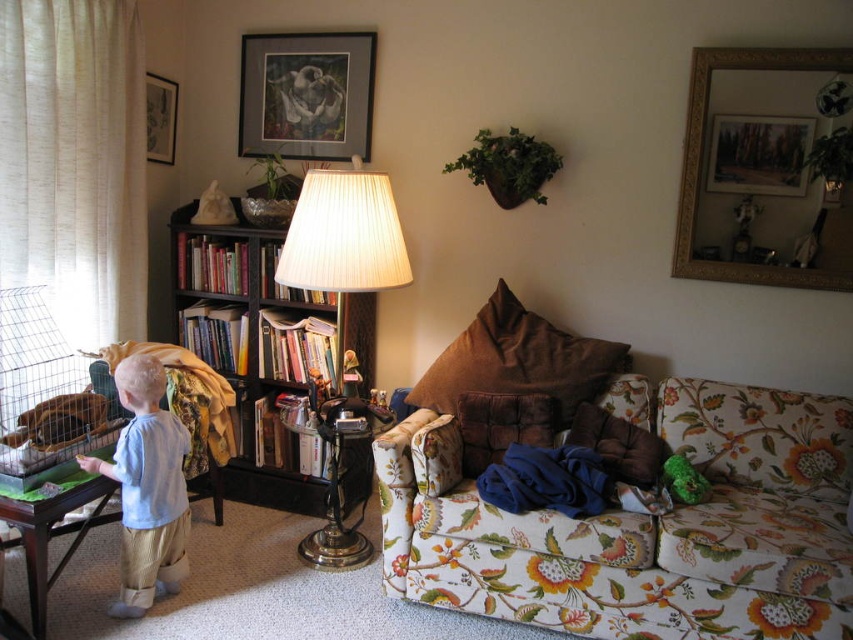
Question: Which of the following is the closest to the observer?

Choices:
 (A) matte black picture frame at upper center
 (B) black wood bookcase at left
 (C) green fuzzy toy at couch
 (D) light blue cotton shirt at lower left

Answer: (D)

Question: Which of these objects is positioned farthest from the gold-framed mirror at upper right?

Choices:
 (A) black wood bookcase at left
 (B) matte black picture frame at upper left
 (C) light blue cotton shirt at lower left
 (D) green fuzzy toy at couch

Answer: (B)

Question: Does black wood bookcase at left have a smaller size compared to matte black picture frame at upper left?

Choices:
 (A) yes
 (B) no

Answer: (B)

Question: Based on their relative distances, which object is farther from the matte black picture frame at upper left?

Choices:
 (A) floral fabric couch at center
 (B) green fuzzy toy at couch
 (C) wooden framed picture at upper center

Answer: (B)

Question: Does floral fabric couch at center have a larger size compared to metallic/brass lamp at center?

Choices:
 (A) yes
 (B) no

Answer: (A)

Question: Considering the relative positions of wooden framed picture at upper center and matte black picture frame at upper left in the image provided, where is wooden framed picture at upper center located with respect to matte black picture frame at upper left?

Choices:
 (A) right
 (B) left

Answer: (A)